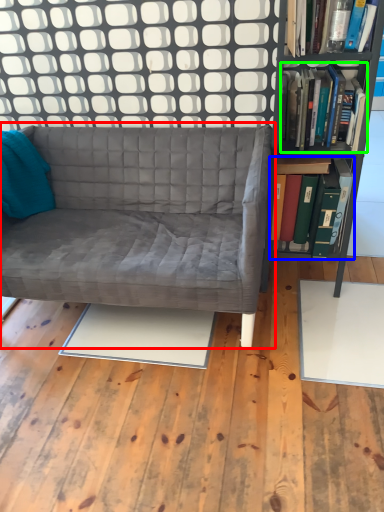
Question: Which object is the closest to the studio couch (highlighted by a red box)? Choose among these: book (highlighted by a blue box) or book (highlighted by a green box).

Choices:
 (A) book
 (B) book

Answer: (B)